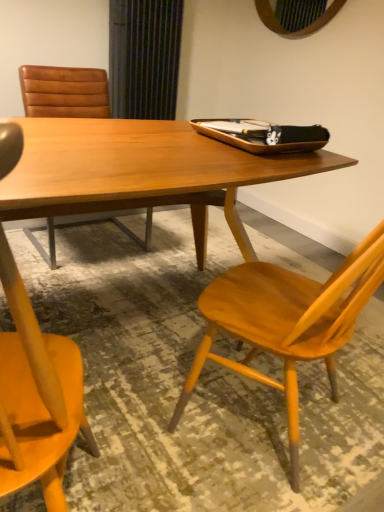
Question: Can you confirm if wooden table at center is positioned to the right of brown leather chair at upper left, acting as the second chair starting from the right?

Choices:
 (A) no
 (B) yes

Answer: (B)

Question: From the image's perspective, would you say wooden table at center is shown under brown leather chair at upper left, acting as the second chair starting from the right?

Choices:
 (A) no
 (B) yes

Answer: (B)

Question: Does wooden table at center have a lesser width compared to brown leather chair at upper left, the 1th chair positioned from the back?

Choices:
 (A) yes
 (B) no

Answer: (B)

Question: Does wooden table at center have a larger size compared to brown leather chair at upper left, acting as the second chair starting from the right?

Choices:
 (A) yes
 (B) no

Answer: (A)

Question: Is brown leather chair at upper left, acting as the second chair starting from the right, at the back of wooden table at center?

Choices:
 (A) yes
 (B) no

Answer: (A)

Question: Is wooden chair at right, the 1th chair viewed from the right, spatially inside wooden table at center, or outside of it?

Choices:
 (A) outside
 (B) inside

Answer: (A)

Question: Is wooden chair at right, the second chair in the back-to-front sequence, wider or thinner than wooden table at center?

Choices:
 (A) wide
 (B) thin

Answer: (B)

Question: From the image's perspective, relative to wooden table at center, is wooden chair at right, which is the 1th chair from front to back, above or below?

Choices:
 (A) below
 (B) above

Answer: (A)

Question: In the image, is wooden chair at right, the second chair in the back-to-front sequence, on the left side or the right side of wooden table at center?

Choices:
 (A) left
 (B) right

Answer: (B)

Question: Considering the positions of point (26, 92) and point (1, 169), is point (26, 92) closer or farther from the camera than point (1, 169)?

Choices:
 (A) closer
 (B) farther

Answer: (B)

Question: Is brown leather chair at upper left, the 1th chair positioned from the back, taller or shorter than wooden table at center?

Choices:
 (A) short
 (B) tall

Answer: (B)

Question: From the image's perspective, is brown leather chair at upper left, the 1th chair positioned from the back, positioned above or below wooden table at center?

Choices:
 (A) above
 (B) below

Answer: (A)

Question: In the image, is brown leather chair at upper left, which is the 1th chair in left-to-right order, on the left side or the right side of wooden table at center?

Choices:
 (A) left
 (B) right

Answer: (A)

Question: Looking at the image, does brown leather chair at upper left, which appears as the second chair when viewed from the front, seem bigger or smaller compared to wooden chair at right, the 1th chair viewed from the right?

Choices:
 (A) big
 (B) small

Answer: (A)

Question: Is brown leather chair at upper left, which appears as the second chair when viewed from the front, situated inside wooden chair at right, the 1th chair viewed from the right, or outside?

Choices:
 (A) inside
 (B) outside

Answer: (B)